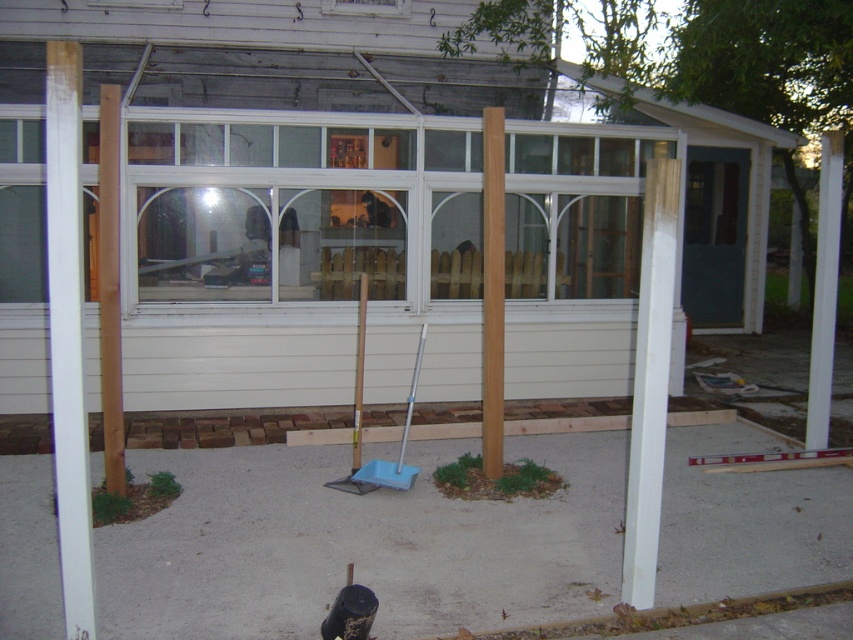
You are a contractor assessing the construction site. You notice the light brown wood pole at center and the wooden handle shovel at center. Which object has a larger width?

The light brown wood pole at center might be wider than wooden handle shovel at center according to the description.

You are a construction worker who needs to move the wooden handle shovel at center to the left side of the light brown wood pole at center. Is this possible without moving the pole?

The light brown wood pole at center is positioned on the right side of the wooden handle shovel at center. To move the shovel to the left of the pole, you would need to shift the shovel from its current position to the left, which would require moving the pole first since it is currently blocking the shovel from being on the left side.

You are standing in front of the partially constructed greenhouse and see two light brown wood poles. Which one is nearer to you, the light brown wood pole at left or the light brown wood pole at center?

The light brown wood pole at left is closer to the viewer than the light brown wood pole at center, so the pole at left is nearer.